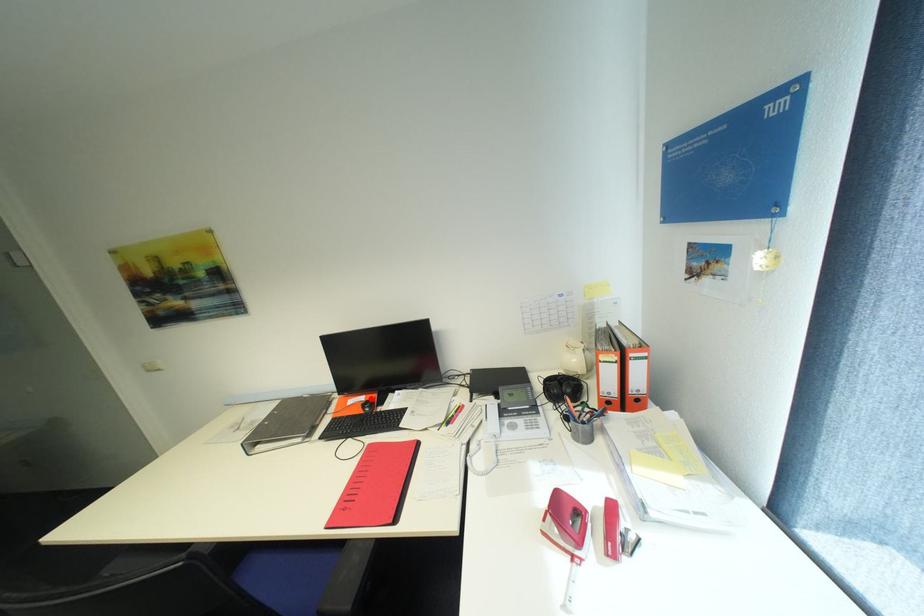
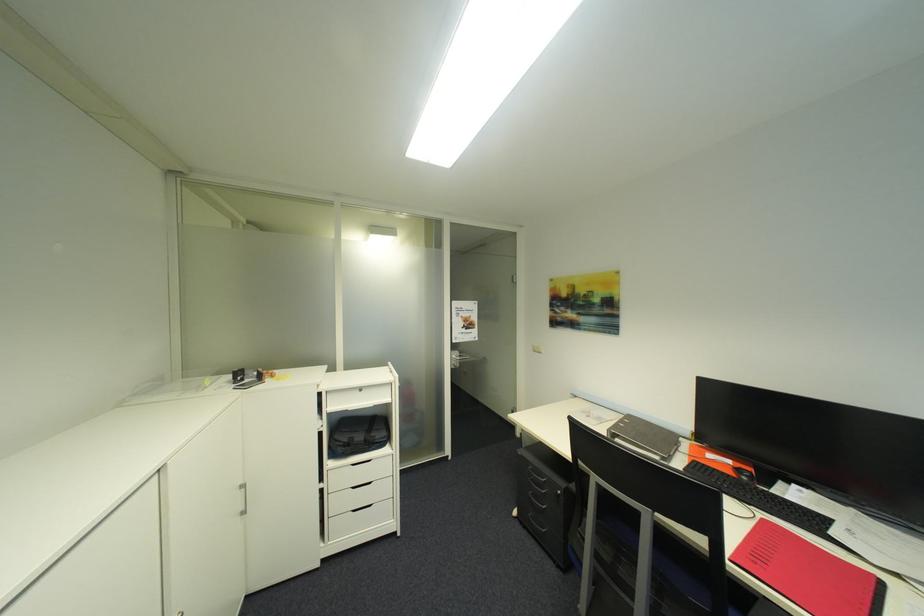
Find the pixel in the second image that matches the highlighted location in the first image.

(736, 463)